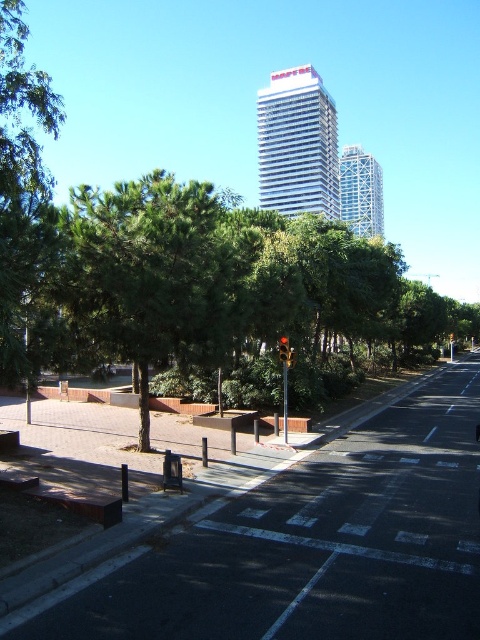
Question: Which of the following is the closest to the observer?

Choices:
 (A) (288, 348)
 (B) (24, 188)

Answer: (B)

Question: Which is farther from the green leafy tree at left?

Choices:
 (A) wooden bench at lower left
 (B) red glass traffic light at center

Answer: (B)

Question: Which of the following is the closest to the observer?

Choices:
 (A) wooden bench at lower left
 (B) green leafy tree at left

Answer: (B)

Question: Is green leafy tree at left wider than red glass traffic light at center?

Choices:
 (A) no
 (B) yes

Answer: (B)

Question: Does wooden bench at lower left appear over red glass traffic light at center?

Choices:
 (A) yes
 (B) no

Answer: (B)

Question: Does wooden bench at lower left have a greater width compared to red glass traffic light at center?

Choices:
 (A) no
 (B) yes

Answer: (B)